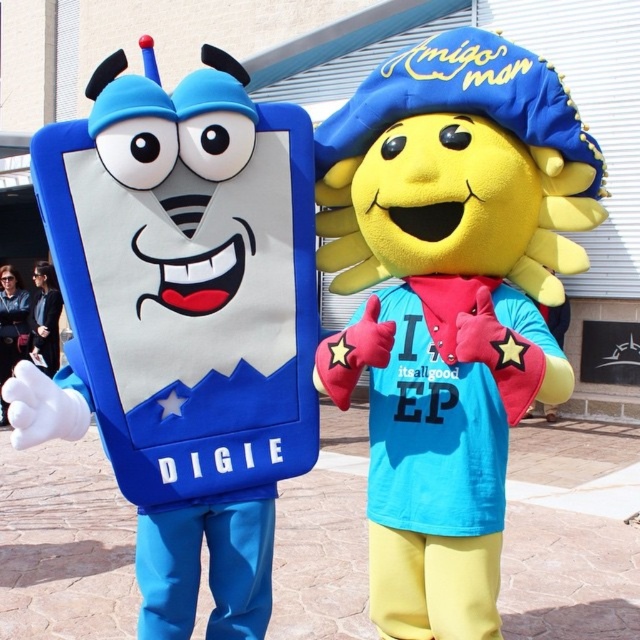
Question: Is matte blue phone at left to the left of black fabric jacket at lower left from the viewer's perspective?

Choices:
 (A) yes
 (B) no

Answer: (B)

Question: Is yellow plush sun at center closer to the viewer compared to dark blue leather jacket at lower left?

Choices:
 (A) no
 (B) yes

Answer: (B)

Question: Is dark blue leather jacket at lower left to the right of black fabric jacket at lower left from the viewer's perspective?

Choices:
 (A) no
 (B) yes

Answer: (A)

Question: Which object is positioned farthest from the dark blue leather jacket at lower left?

Choices:
 (A) yellow plush sun at center
 (B) black fabric jacket at lower left
 (C) matte blue phone at left

Answer: (A)

Question: Which of the following is the farthest from the observer?

Choices:
 (A) (12, 280)
 (B) (257, 452)
 (C) (42, 321)

Answer: (C)

Question: Among these objects, which one is nearest to the camera?

Choices:
 (A) yellow plush sun at center
 (B) black fabric jacket at lower left
 (C) dark blue leather jacket at lower left
 (D) matte blue phone at left

Answer: (D)